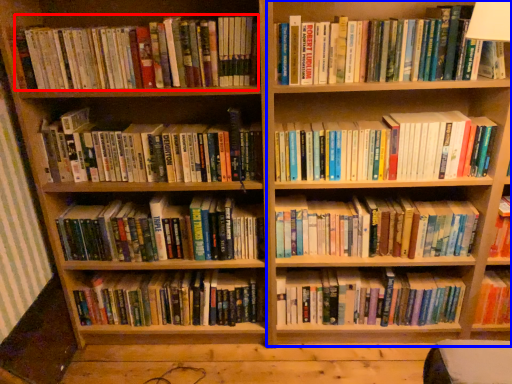
Question: Which object is further to the camera taking this photo, book (highlighted by a red box) or bookshelf (highlighted by a blue box)?

Choices:
 (A) book
 (B) bookshelf

Answer: (A)